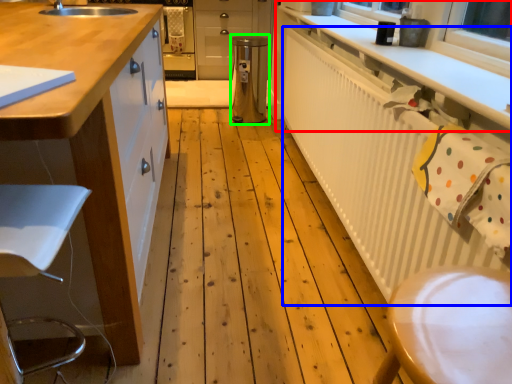
Question: Which object is the farthest from countertop (highlighted by a red box)? Choose among these: radiator (highlighted by a blue box) or appliance (highlighted by a green box).

Choices:
 (A) radiator
 (B) appliance

Answer: (B)